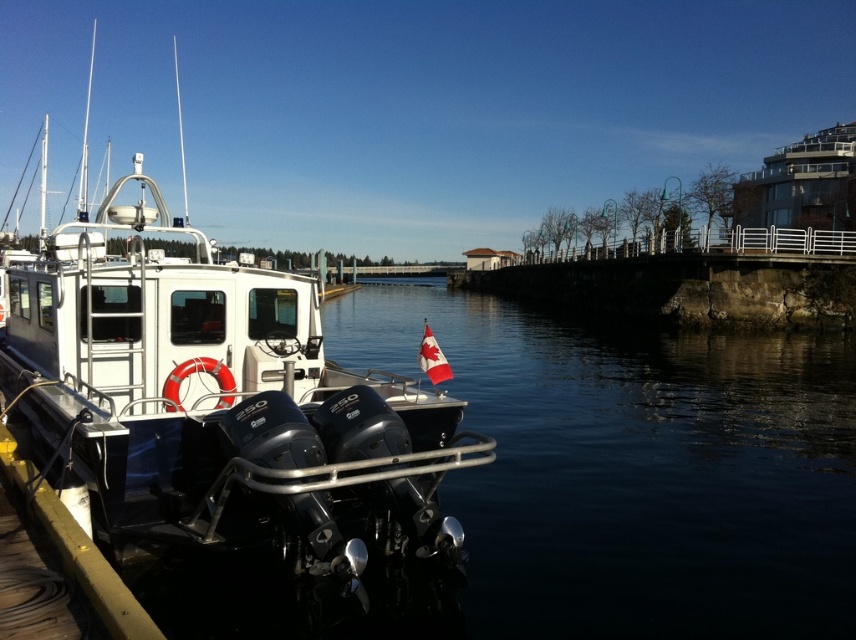
Can you confirm if dark blue water at lower left is taller than white glossy boat at left?

In fact, dark blue water at lower left may be shorter than white glossy boat at left.

Where is `dark blue water at lower left`? dark blue water at lower left is located at coordinates (634, 467).